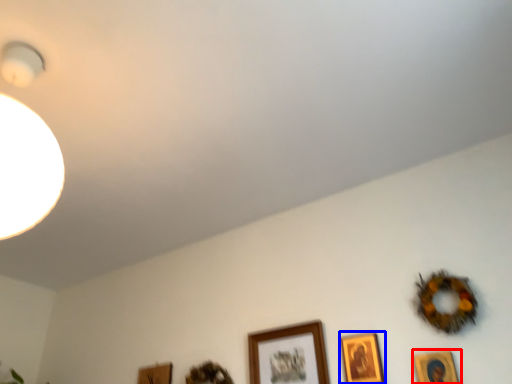
Question: Which point is closer to the camera, picture frame (highlighted by a red box) or picture frame (highlighted by a blue box)?

Choices:
 (A) picture frame
 (B) picture frame

Answer: (A)